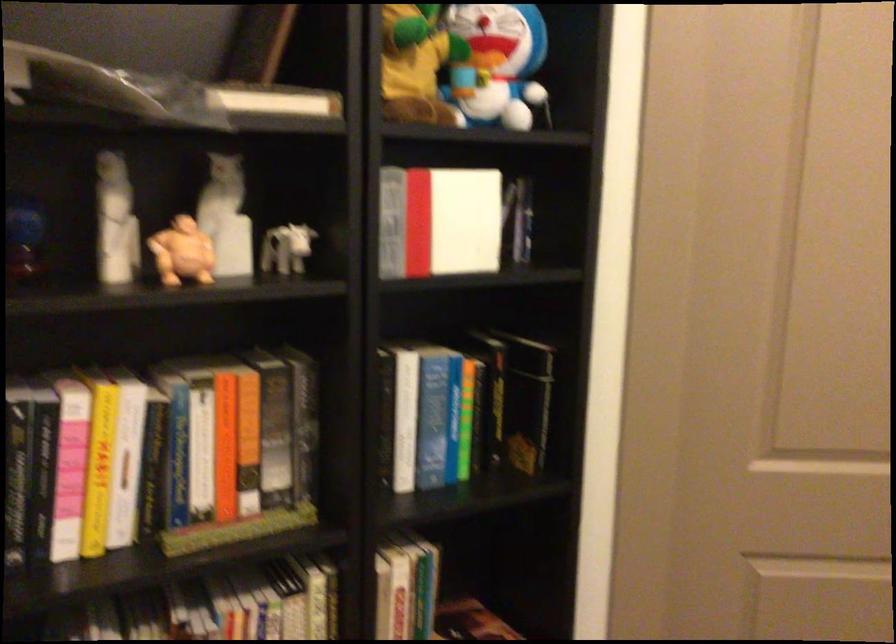
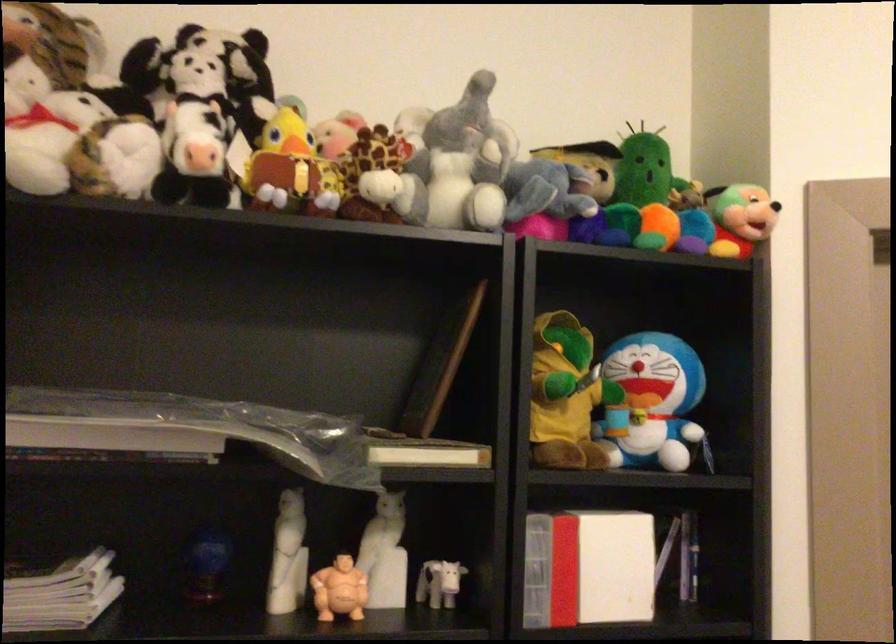
Locate, in the second image, the point that corresponds to point 224,223 in the first image.

(384, 554)